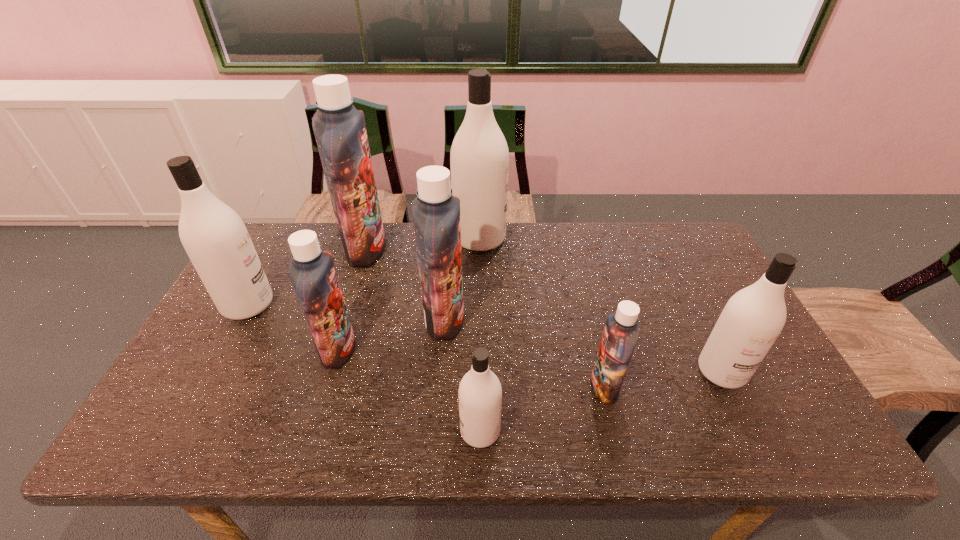
Find the location of a particular element. The image size is (960, 540). the nearest white shampoo is located at coordinates (480, 393).

Where is `the smallest white shampoo`? the smallest white shampoo is located at coordinates (480, 393).

Locate an element on the screen. The height and width of the screenshot is (540, 960). blank space located on the front label of the biggest blue shampoo is located at coordinates (480, 249).

This screenshot has height=540, width=960. What are the coordinates of `vacant area situated 0.260m on the front-facing side of the farthest white shampoo` in the screenshot? It's located at (583, 239).

You are a GUI agent. You are given a task and a screenshot of the screen. Output one action in this format:
    pyautogui.click(x=<x>, y=<y>)
    Task: Click on the vacant area located 0.050m on the front-facing side of the leftmost white shampoo
    
    Given the screenshot: What is the action you would take?
    pyautogui.click(x=291, y=304)

Locate an element on the screen. This screenshot has width=960, height=540. free space located on the front label of the second biggest blue shampoo is located at coordinates (486, 319).

What are the coordinates of `free spot located 0.300m on the front label of the third biggest blue shampoo` in the screenshot? It's located at (470, 349).

Where is `vacant space situated on the front-facing side of the third farthest white shampoo`? The width and height of the screenshot is (960, 540). vacant space situated on the front-facing side of the third farthest white shampoo is located at coordinates (755, 440).

Locate an element on the screen. The image size is (960, 540). vacant space located on the front label of the rightmost blue shampoo is located at coordinates (528, 386).

Where is `vacant space situated 0.240m on the front label of the rightmost blue shampoo`? vacant space situated 0.240m on the front label of the rightmost blue shampoo is located at coordinates (491, 386).